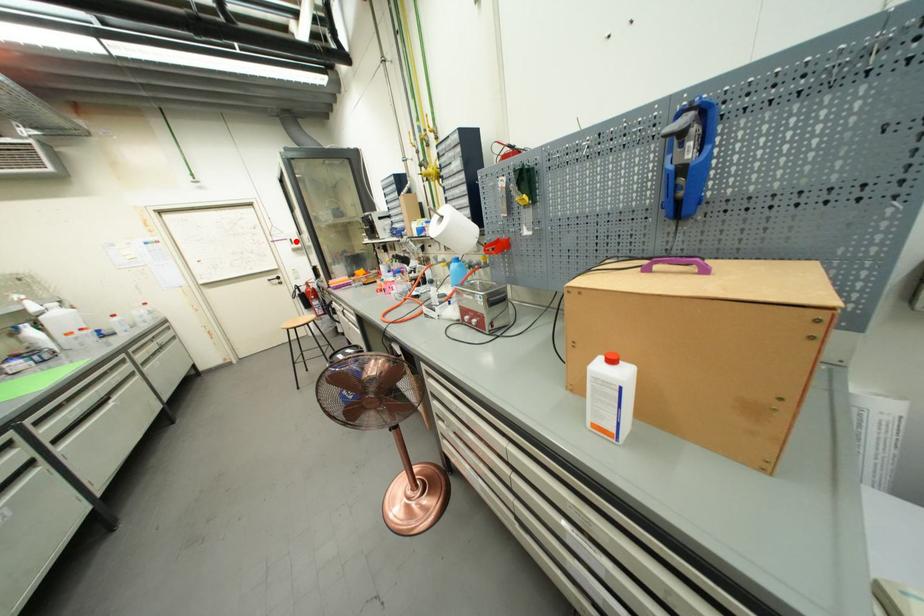
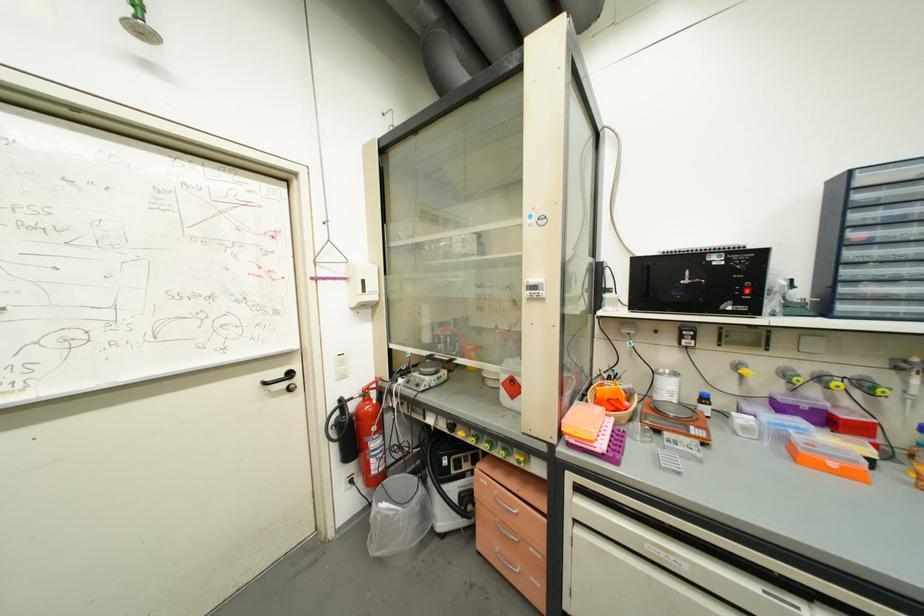
Question: I am providing you with two images of the same scene from different viewpoints. Given a red point in image1, look at the same physical point in image2. Is it:

Choices:
 (A) Closer to the viewpoint
 (B) Farther from the viewpoint

Answer: (B)